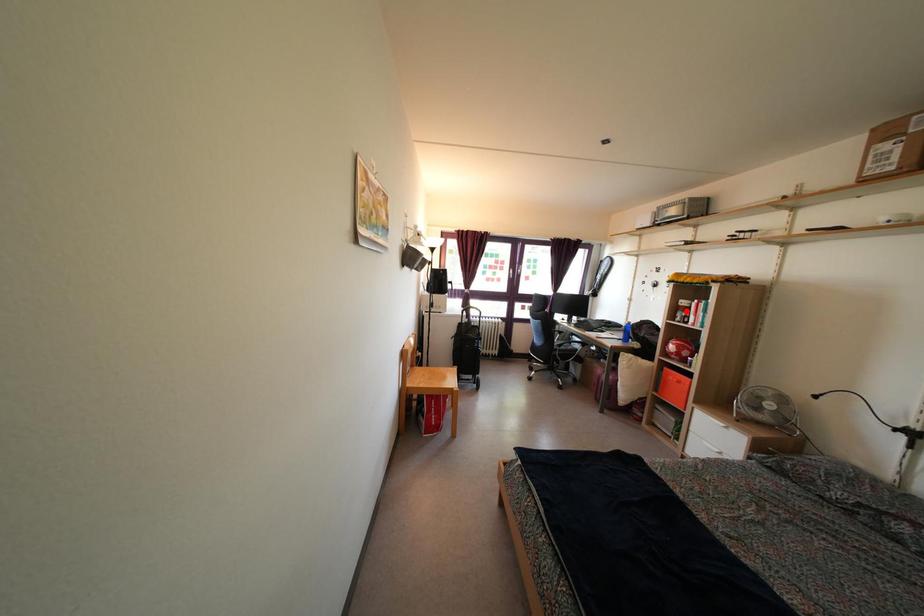
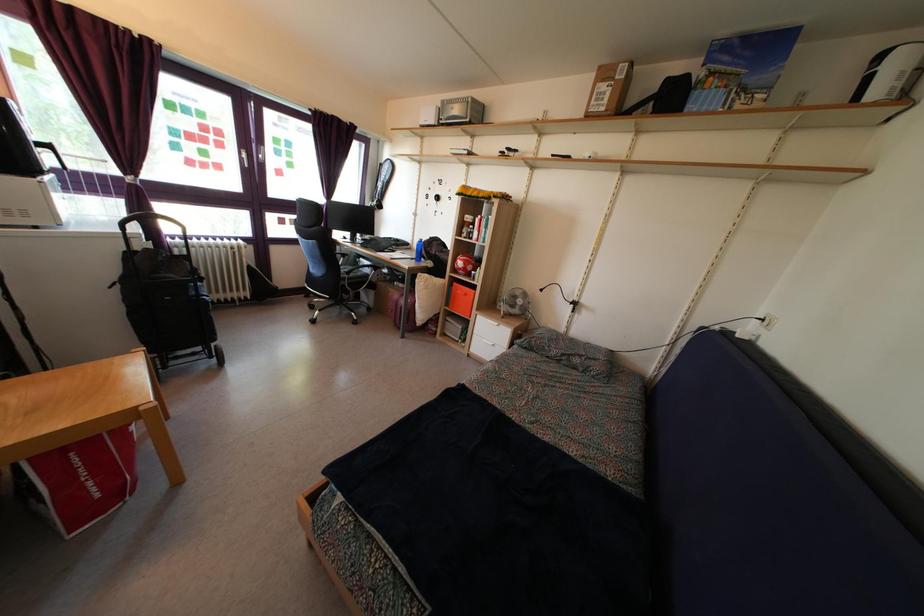
Where in the second image is the point corresponding to the highlighted location from the first image?

(470, 227)